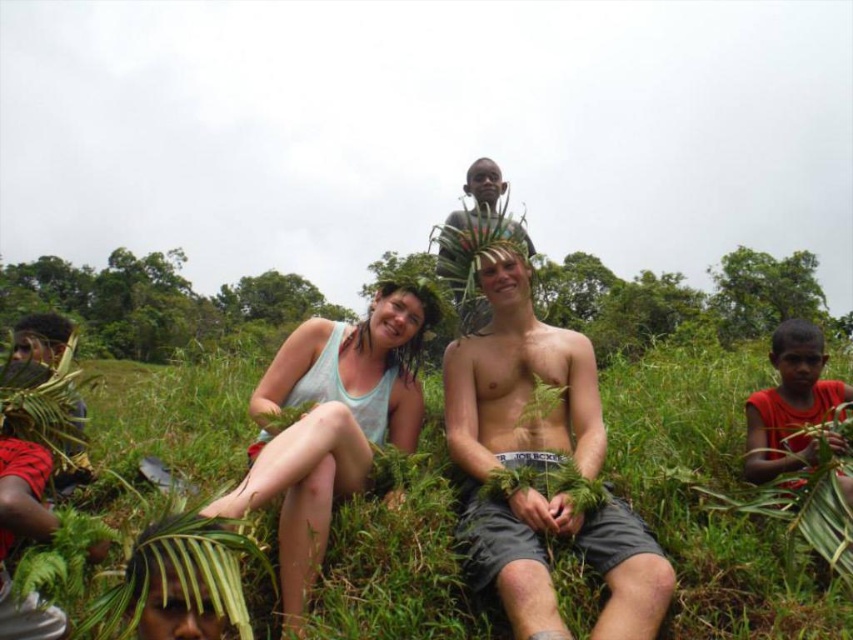
The height and width of the screenshot is (640, 853). What do you see at coordinates (540, 465) in the screenshot? I see `smooth skin man at center` at bounding box center [540, 465].

Is smooth skin man at center further to the viewer compared to white tank top at center?

That is True.

Identify the location of smooth skin man at center. This screenshot has height=640, width=853. coord(540,465).

Can you confirm if green leafy grass at center is bigger than white tank top at center?

Correct, green leafy grass at center is larger in size than white tank top at center.

Who is positioned more to the right, green leafy grass at center or white tank top at center?

green leafy grass at center is more to the right.

Who is more forward, (440, 490) or (318, 456)?

Positioned in front is point (318, 456).

Where is `green leafy grass at center`? green leafy grass at center is located at coordinates (711, 509).

Measure the distance between point (461, 458) and camera.

6.71 meters

Is point (466, 529) in front of point (811, 356)?

That is True.

Who is more forward, (584, 419) or (788, 460)?

Point (788, 460)

Where is `smooth skin man at center`? The height and width of the screenshot is (640, 853). smooth skin man at center is located at coordinates (540, 465).